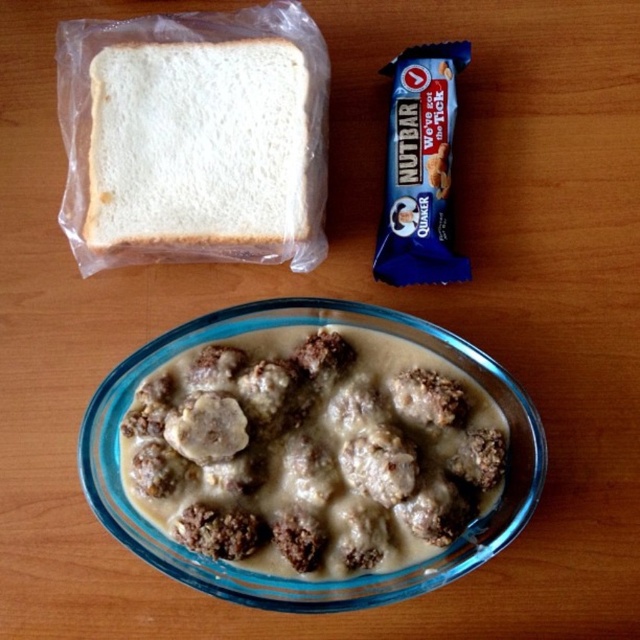
Question: Observing the image, what is the correct spatial positioning of white matte bread at upper left in reference to blue wrapper bar at upper right?

Choices:
 (A) left
 (B) right

Answer: (A)

Question: Which point is farther from the camera taking this photo?

Choices:
 (A) (403, 445)
 (B) (93, 83)

Answer: (B)

Question: Does brown crumbly meatballs at center appear over blue wrapper bar at upper right?

Choices:
 (A) yes
 (B) no

Answer: (B)

Question: Does brown crumbly meatballs at center have a lesser width compared to blue wrapper bar at upper right?

Choices:
 (A) no
 (B) yes

Answer: (A)

Question: Estimate the real-world distances between objects in this image. Which object is farther from the white matte bread at upper left?

Choices:
 (A) brown crumbly meatballs at center
 (B) blue wrapper bar at upper right

Answer: (A)

Question: Which object is the closest to the blue wrapper bar at upper right?

Choices:
 (A) brown crumbly meatballs at center
 (B) white matte bread at upper left

Answer: (A)